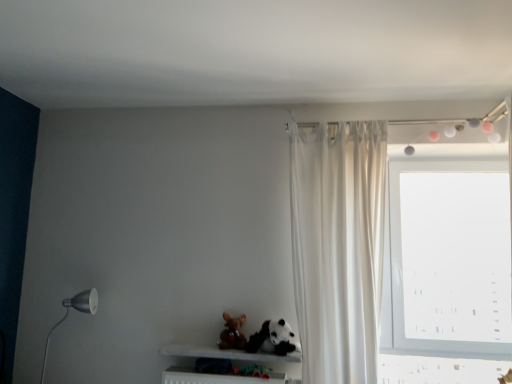
Question: From a real-world perspective, is velvety brown teddy bear at lower center over matte black lamp at left?

Choices:
 (A) no
 (B) yes

Answer: (B)

Question: From the image's perspective, does velvety brown teddy bear at lower center appear higher than matte black lamp at left?

Choices:
 (A) no
 (B) yes

Answer: (B)

Question: Is velvety brown teddy bear at lower center positioned with its back to matte black lamp at left?

Choices:
 (A) no
 (B) yes

Answer: (A)

Question: Is velvety brown teddy bear at lower center behind matte black lamp at left?

Choices:
 (A) yes
 (B) no

Answer: (B)

Question: Is velvety brown teddy bear at lower center next to matte black lamp at left and touching it?

Choices:
 (A) yes
 (B) no

Answer: (B)

Question: Is velvety brown teddy bear at lower center far from matte black lamp at left?

Choices:
 (A) yes
 (B) no

Answer: (B)

Question: From the image's perspective, is transparent glass window at upper right below matte black lamp at left?

Choices:
 (A) yes
 (B) no

Answer: (B)

Question: From a real-world perspective, is transparent glass window at upper right positioned over matte black lamp at left based on gravity?

Choices:
 (A) yes
 (B) no

Answer: (A)

Question: Is transparent glass window at upper right far away from matte black lamp at left?

Choices:
 (A) yes
 (B) no

Answer: (A)

Question: Considering the relative sizes of transparent glass window at upper right and matte black lamp at left in the image provided, is transparent glass window at upper right wider than matte black lamp at left?

Choices:
 (A) no
 (B) yes

Answer: (A)

Question: Is transparent glass window at upper right bigger than matte black lamp at left?

Choices:
 (A) yes
 (B) no

Answer: (A)

Question: Does transparent glass window at upper right have a greater height compared to matte black lamp at left?

Choices:
 (A) no
 (B) yes

Answer: (B)

Question: Is black plush panda at lower center surrounded by transparent glass window at upper right?

Choices:
 (A) no
 (B) yes

Answer: (A)